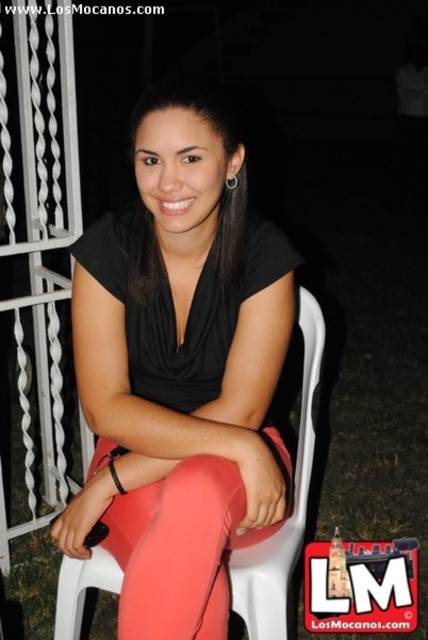
You are standing in front of the railing on the balcony and want to place a small potted plant between the two points marked as point (276, 476) and point (223, 525). Which point should the plant be closer to in order to be closer to the camera?

The plant should be closer to point (276, 476) because it is further to the camera than point (223, 525).